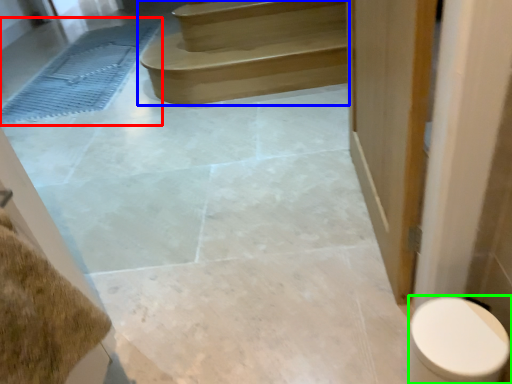
Question: Based on their relative distances, which object is nearer to bath mat (highlighted by a red box)? Choose from stairs (highlighted by a blue box) and toilet (highlighted by a green box).

Choices:
 (A) stairs
 (B) toilet

Answer: (A)